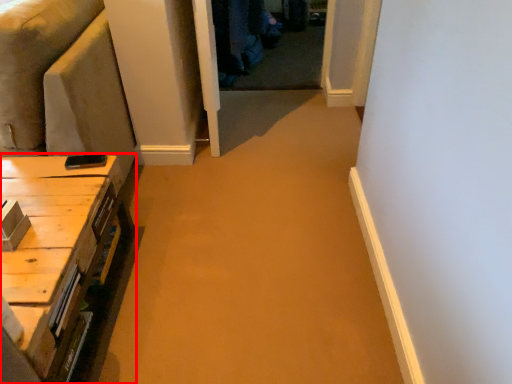
Question: Where is table (annotated by the red box) located in relation to couch in the image?

Choices:
 (A) left
 (B) right

Answer: (B)